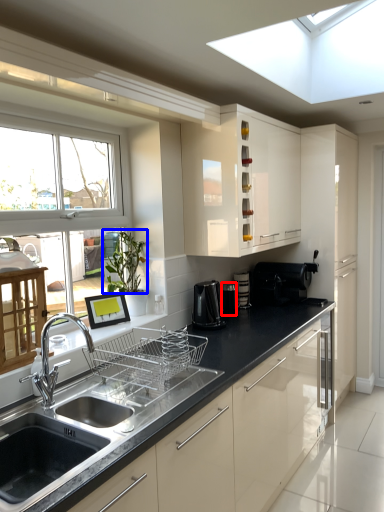
Question: Among these objects, which one is farthest to the camera, appliance (highlighted by a red box) or plant (highlighted by a blue box)?

Choices:
 (A) appliance
 (B) plant

Answer: (A)